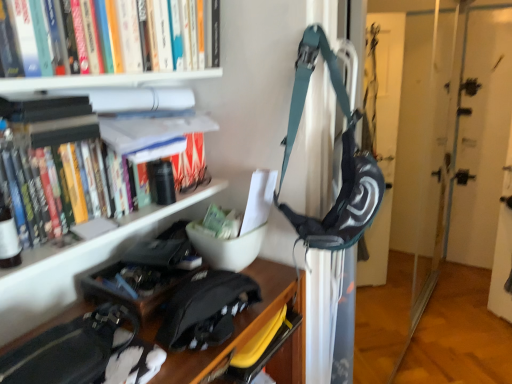
Locate an element on the screen. This screenshot has width=512, height=384. black matte messenger bag at lower center is located at coordinates (206, 309).

Find the location of a particular element. This screenshot has height=384, width=512. white matte bookshelf at upper left is located at coordinates (106, 87).

This screenshot has height=384, width=512. What do you see at coordinates (33, 38) in the screenshot?
I see `hardcover books at upper left` at bounding box center [33, 38].

Locate an element on the screen. black matte messenger bag at lower center is located at coordinates point(206,309).

Considering the sizes of black matte messenger bag at lower center and teal fabric backpack at center in the image, is black matte messenger bag at lower center taller or shorter than teal fabric backpack at center?

Clearly, black matte messenger bag at lower center is shorter compared to teal fabric backpack at center.

Choose the correct answer: Is black matte messenger bag at lower center inside teal fabric backpack at center or outside it?

black matte messenger bag at lower center is not enclosed by teal fabric backpack at center.

Image resolution: width=512 pixels, height=384 pixels. Find the location of `messenger bag on the left of teal fabric backpack at center`. messenger bag on the left of teal fabric backpack at center is located at coordinates (206, 309).

Can you tell me how much black matte messenger bag at lower center and teal fabric backpack at center differ in facing direction?

They differ by 22.4 degrees in their facing directions.

Is the position of teal fabric backpack at center more distant than that of white matte bookshelf at upper left?

Yes, teal fabric backpack at center is behind white matte bookshelf at upper left.

Can you confirm if teal fabric backpack at center is positioned to the left of white matte bookshelf at upper left?

Incorrect, teal fabric backpack at center is not on the left side of white matte bookshelf at upper left.

How many degrees apart are the facing directions of teal fabric backpack at center and white matte bookshelf at upper left?

The angle between the facing direction of teal fabric backpack at center and the facing direction of white matte bookshelf at upper left is 20.4 degrees.

In terms of width, does teal fabric backpack at center look wider or thinner when compared to white matte bookshelf at upper left?

Result: Clearly, teal fabric backpack at center has less width compared to white matte bookshelf at upper left.

Is white matte bookshelf at upper left not close to black matte messenger bag at lower center?

They are positioned close to each other.

From a real-world perspective, is white matte bookshelf at upper left on top of black matte messenger bag at lower center?

Yes, from a real-world perspective, white matte bookshelf at upper left is on top of black matte messenger bag at lower center.

Is white matte bookshelf at upper left aimed at black matte messenger bag at lower center?

Yes, white matte bookshelf at upper left is oriented towards black matte messenger bag at lower center.

Is point (121, 78) closer or farther from the camera than point (234, 288)?

Clearly, point (121, 78) is closer to the camera than point (234, 288).

Is teal fabric backpack at center directly adjacent to black matte messenger bag at lower center?

No, teal fabric backpack at center is not next to black matte messenger bag at lower center.

Which is less distant, (282, 206) or (180, 330)?

The point (180, 330) is closer.

Considering the relative positions of teal fabric backpack at center and black matte messenger bag at lower center in the image provided, is teal fabric backpack at center behind black matte messenger bag at lower center?

Yes, the depth of teal fabric backpack at center is greater than that of black matte messenger bag at lower center.

From the image's perspective, who appears lower, teal fabric backpack at center or black matte messenger bag at lower center?

black matte messenger bag at lower center is shown below in the image.

Could you tell me if hardcover books at upper left is turned towards white matte bookshelf at upper left?

Yes, hardcover books at upper left is aimed at white matte bookshelf at upper left.

Can you see hardcover books at upper left touching white matte bookshelf at upper left?

No, hardcover books at upper left is not next to white matte bookshelf at upper left.

Is hardcover books at upper left spatially inside white matte bookshelf at upper left, or outside of it?

hardcover books at upper left is inside white matte bookshelf at upper left.

From a real-world perspective, who is located higher, hardcover books at upper left or white matte bookshelf at upper left?

hardcover books at upper left, from a real-world perspective.

Locate an element on the screen. bookcase lying below the hardcover books at upper left (from the image's perspective) is located at coordinates (106, 87).

From the image's perspective, is white matte bookshelf at upper left positioned above or below hardcover books at upper left?

Clearly, from the image's perspective, white matte bookshelf at upper left is below hardcover books at upper left.

Can you confirm if white matte bookshelf at upper left is taller than hardcover books at upper left?

Yes.

Who is bigger, white matte bookshelf at upper left or hardcover books at upper left?

Bigger between the two is white matte bookshelf at upper left.

Is white matte bookshelf at upper left spatially inside teal fabric backpack at center, or outside of it?

white matte bookshelf at upper left is not inside teal fabric backpack at center, it's outside.

Which is in front, white matte bookshelf at upper left or teal fabric backpack at center?

white matte bookshelf at upper left is in front.

Between white matte bookshelf at upper left and teal fabric backpack at center, which one has smaller size?

teal fabric backpack at center.

The image size is (512, 384). Identify the location of shoulder bag on the right side of black matte messenger bag at lower center. (341, 159).

You are a GUI agent. You are given a task and a screenshot of the screen. Output one action in this format:
    pyautogui.click(x=<x>, y=<y>)
    Task: Click on the bookcase located above the teal fabric backpack at center (from a real-world perspective)
    The width and height of the screenshot is (512, 384).
    Given the screenshot: What is the action you would take?
    pyautogui.click(x=106, y=87)

Which object lies further to the anchor point hardcover books at upper left, white matte bookshelf at upper left or teal fabric backpack at center?

teal fabric backpack at center is further to hardcover books at upper left.

Considering their positions, is hardcover books at upper left positioned further to white matte bookshelf at upper left than teal fabric backpack at center?

Among the two, teal fabric backpack at center is located further to white matte bookshelf at upper left.

Considering their positions, is black matte messenger bag at lower center positioned further to white matte bookshelf at upper left than teal fabric backpack at center?

black matte messenger bag at lower center lies further to white matte bookshelf at upper left than the other object.

Estimate the real-world distances between objects in this image. Which object is closer to black matte messenger bag at lower center, teal fabric backpack at center or hardcover books at upper left?

The object closer to black matte messenger bag at lower center is teal fabric backpack at center.

Considering their positions, is teal fabric backpack at center positioned closer to white matte bookshelf at upper left than black matte messenger bag at lower center?

teal fabric backpack at center.

Which object lies further to the anchor point hardcover books at upper left, white matte bookshelf at upper left or black matte messenger bag at lower center?

The object further to hardcover books at upper left is black matte messenger bag at lower center.

In the scene shown: Considering their positions, is hardcover books at upper left positioned closer to white matte bookshelf at upper left than black matte messenger bag at lower center?

hardcover books at upper left.

From the image, which object appears to be nearer to teal fabric backpack at center, white matte bookshelf at upper left or black matte messenger bag at lower center?

black matte messenger bag at lower center is positioned closer to the anchor teal fabric backpack at center.

The width and height of the screenshot is (512, 384). I want to click on shoulder bag between hardcover books at upper left and black matte messenger bag at lower center in the up-down direction, so click(x=341, y=159).

At what (x,y) coordinates should I click in order to perform the action: click on bookcase between hardcover books at upper left and black matte messenger bag at lower center in the vertical direction. Please return your answer as a coordinate pair (x, y). The width and height of the screenshot is (512, 384). Looking at the image, I should click on (106, 87).

This screenshot has width=512, height=384. I want to click on messenger bag between white matte bookshelf at upper left and teal fabric backpack at center in the horizontal direction, so click(x=206, y=309).

I want to click on bookcase between hardcover books at upper left and teal fabric backpack at center in the horizontal direction, so click(106, 87).